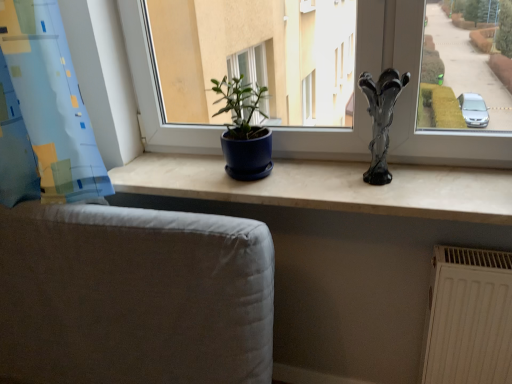
Where is `vacant area located to the right-hand side of transparent glass vase at right`? This screenshot has height=384, width=512. vacant area located to the right-hand side of transparent glass vase at right is located at coordinates (426, 175).